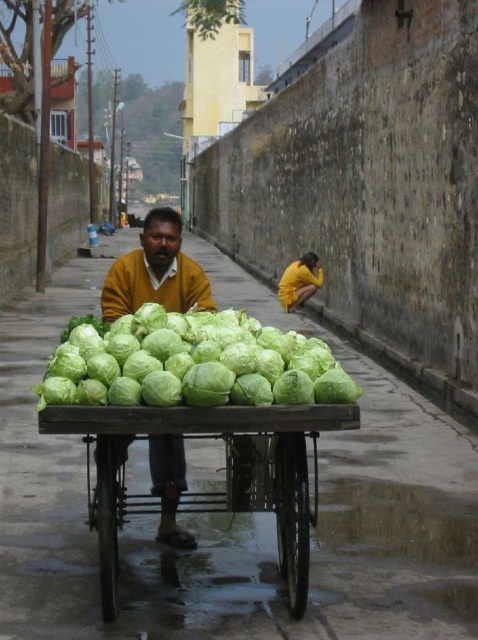
In the scene shown: You are a customer looking to buy cabbages. You see the green leafy cabbage at center and the yellow sweater at center. Which object is closer to the ground?

The green leafy cabbage at center is closer to the ground because it is positioned below the yellow sweater at center.

You are a pedestrian on the street and want to walk past the wooden cart at center and the yellow sweater at center. Which object should you avoid bumping into first?

The wooden cart at center is in front of the yellow sweater at center, so you should avoid bumping into the wooden cart at center first.

Based on the photo, you are a delivery person who needs to place a package between the green leafy cabbage at center and the yellow sweater at center. The package is 80 centimeters long. Will it fit between them?

The distance between the green leafy cabbage at center and the yellow sweater at center is 79.73 centimeters. Since the package is 80 centimeters long, it will not fit between them as the space is slightly shorter than the package.